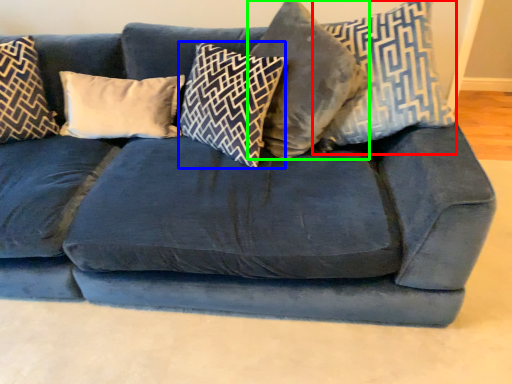
Question: Which object is the closest to the pillow (highlighted by a red box)? Choose among these: pillow (highlighted by a blue box) or pillow (highlighted by a green box).

Choices:
 (A) pillow
 (B) pillow

Answer: (B)